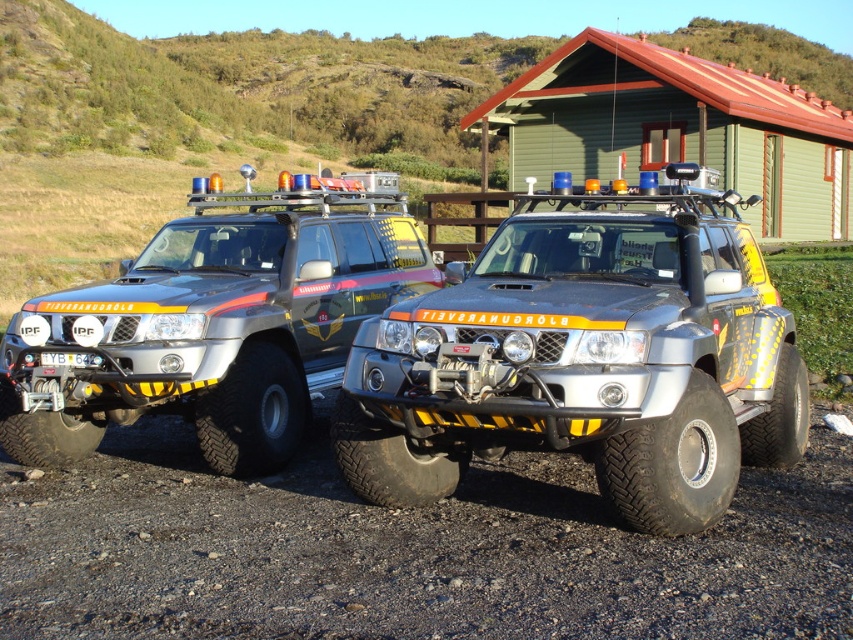
Question: Is dirt track at lower left thinner than matte black suv at center?

Choices:
 (A) no
 (B) yes

Answer: (A)

Question: Can you confirm if dirt track at lower left is positioned to the right of silver metallic suv at center?

Choices:
 (A) yes
 (B) no

Answer: (A)

Question: Among these objects, which one is farthest from the camera?

Choices:
 (A) green wooden hut at upper center
 (B) silver metallic suv at center
 (C) matte black suv at center
 (D) dirt track at lower left

Answer: (A)

Question: Based on their relative distances, which object is nearer to the matte black suv at center?

Choices:
 (A) silver metallic suv at center
 (B) green wooden hut at upper center
 (C) dirt track at lower left

Answer: (C)

Question: Which point appears closest to the camera in this image?

Choices:
 (A) (144, 456)
 (B) (546, 134)
 (C) (440, 380)
 (D) (192, 250)

Answer: (C)

Question: Does matte black suv at center have a larger size compared to silver metallic suv at center?

Choices:
 (A) no
 (B) yes

Answer: (A)